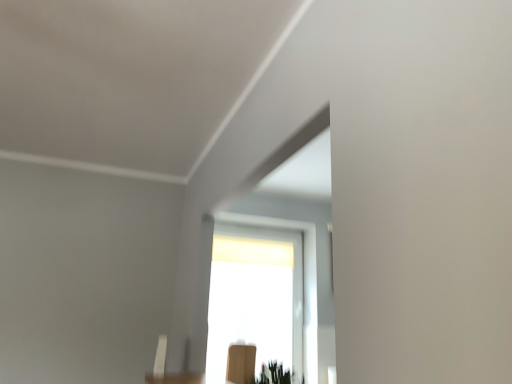
This screenshot has height=384, width=512. In order to click on wooden chair at lower center in this screenshot , I will do `click(241, 363)`.

In order to click on wooden chair at lower center in this screenshot , I will do `click(241, 363)`.

How different are the orientations of transparent glass window at center and green matte plant at lower center in degrees?

The angle between the facing direction of transparent glass window at center and the facing direction of green matte plant at lower center is 93.8 degrees.

Based on the photo, from the image's perspective, which is above, transparent glass window at center or green matte plant at lower center?

green matte plant at lower center, from the image's perspective.

Where is `window lying below the green matte plant at lower center (from the image's perspective)`? The height and width of the screenshot is (384, 512). window lying below the green matte plant at lower center (from the image's perspective) is located at coordinates (256, 295).

Considering the sizes of objects transparent glass window at center and green matte plant at lower center in the image provided, who is taller, transparent glass window at center or green matte plant at lower center?

With more height is transparent glass window at center.

From a real-world perspective, who is located lower, green matte plant at lower center or wooden chair at lower center?

From a 3D spatial view, wooden chair at lower center is below.

Can you tell me how much green matte plant at lower center and wooden chair at lower center differ in facing direction?

They differ by 91.4 degrees in their facing directions.

From the image's perspective, which is below, green matte plant at lower center or wooden chair at lower center?

wooden chair at lower center is shown below in the image.

Identify the location of furniture located below the green matte plant at lower center (from the image's perspective). (241, 363).

From a real-world perspective, is green matte plant at lower center physically located above or below transparent glass window at center?

green matte plant at lower center is situated lower than transparent glass window at center in the real world.

Is green matte plant at lower center smaller than transparent glass window at center?

Yes, green matte plant at lower center is smaller than transparent glass window at center.

Which point is more distant from viewer, [286,373] or [290,330]?

Positioned behind is point [290,330].

Can you see wooden chair at lower center touching green matte plant at lower center?

No, wooden chair at lower center is not next to green matte plant at lower center.

Can you confirm if wooden chair at lower center is thinner than green matte plant at lower center?

Yes, wooden chair at lower center is thinner than green matte plant at lower center.

From a real-world perspective, is wooden chair at lower center positioned above or below green matte plant at lower center?

Clearly, from a real-world perspective, wooden chair at lower center is below green matte plant at lower center.

Considering the positions of objects wooden chair at lower center and transparent glass window at center in the image provided, who is behind, wooden chair at lower center or transparent glass window at center?

transparent glass window at center is further from the camera.

From the image's perspective, is wooden chair at lower center above or below transparent glass window at center?

From the image's perspective, wooden chair at lower center appears below transparent glass window at center.

Can we say wooden chair at lower center lies outside transparent glass window at center?

Yes, wooden chair at lower center is located beyond the bounds of transparent glass window at center.

Does wooden chair at lower center have a lesser width compared to transparent glass window at center?

Correct, the width of wooden chair at lower center is less than that of transparent glass window at center.

Who is bigger, transparent glass window at center or wooden chair at lower center?

Bigger between the two is transparent glass window at center.

Is transparent glass window at center far away from wooden chair at lower center?

Actually, transparent glass window at center and wooden chair at lower center are a little close together.

Based on the photo, in the image, is transparent glass window at center positioned in front of or behind wooden chair at lower center?

Visually, transparent glass window at center is located behind wooden chair at lower center.

Based on their positions, is transparent glass window at center located to the left or right of wooden chair at lower center?

transparent glass window at center is to the right of wooden chair at lower center.

Find the location of a particular element. window that is on the left side of green matte plant at lower center is located at coordinates (256, 295).

Locate an element on the screen. Image resolution: width=512 pixels, height=384 pixels. furniture behind the green matte plant at lower center is located at coordinates (241, 363).

Which object lies nearer to the anchor point wooden chair at lower center, transparent glass window at center or green matte plant at lower center?

Among the two, transparent glass window at center is located nearer to wooden chair at lower center.

Estimate the real-world distances between objects in this image. Which object is further from transparent glass window at center, wooden chair at lower center or green matte plant at lower center?

green matte plant at lower center.

From the image, which object appears to be farther from green matte plant at lower center, transparent glass window at center or wooden chair at lower center?

transparent glass window at center.

Estimate the real-world distances between objects in this image. Which object is further from transparent glass window at center, green matte plant at lower center or wooden chair at lower center?

green matte plant at lower center.

Considering their positions, is wooden chair at lower center positioned further to green matte plant at lower center than transparent glass window at center?

transparent glass window at center lies further to green matte plant at lower center than the other object.

Based on their spatial positions, is green matte plant at lower center or transparent glass window at center further from wooden chair at lower center?

Among the two, green matte plant at lower center is located further to wooden chair at lower center.

Image resolution: width=512 pixels, height=384 pixels. In order to click on furniture between green matte plant at lower center and transparent glass window at center along the z-axis in this screenshot , I will do `click(241, 363)`.